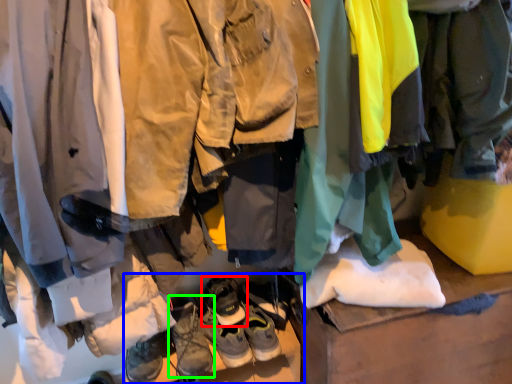
Question: Which is farther away from footwear (highlighted by a red box)? footwear (highlighted by a blue box) or footwear (highlighted by a green box)?

Choices:
 (A) footwear
 (B) footwear

Answer: (A)